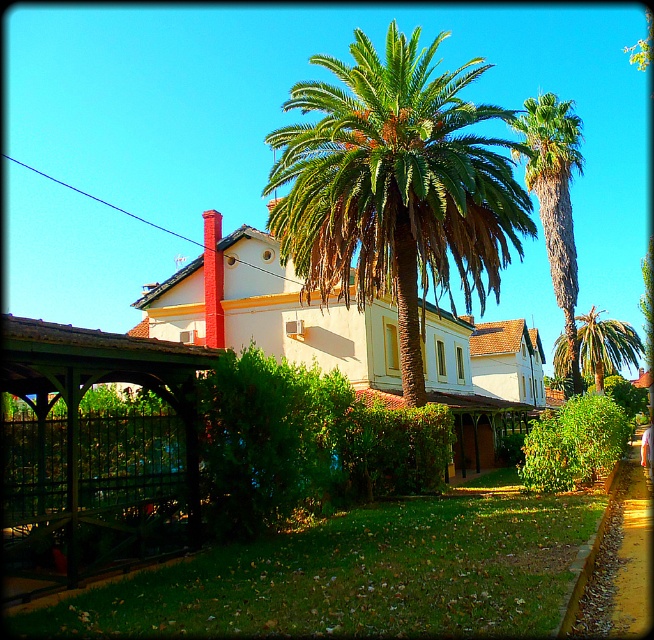
Between point (283, 214) and point (606, 348), which one is positioned in front?

Point (283, 214) is more forward.

Consider the image. Is green leafy palm at center taller than green leafy palm tree at center?

Indeed, green leafy palm at center has a greater height compared to green leafy palm tree at center.

Measure the distance between point (385, 200) and camera.

They are 14.45 meters apart.

Locate an element on the screen. The image size is (654, 640). green leafy palm at center is located at coordinates (396, 186).

Is green leafy palm at center thinner than green leafy palm at upper center?

Yes.

Is green leafy palm at center wider than green leafy palm at upper center?

Incorrect, green leafy palm at center's width does not surpass green leafy palm at upper center's.

Which is behind, point (402, 225) or point (528, 125)?

The point (528, 125) is more distant.

Find the location of `green leafy palm at center`. green leafy palm at center is located at coordinates (396, 186).

The width and height of the screenshot is (654, 640). What do you see at coordinates (555, 198) in the screenshot?
I see `green leafy palm at upper center` at bounding box center [555, 198].

Which is in front, point (532, 141) or point (610, 321)?

Positioned in front is point (532, 141).

Between point (545, 136) and point (555, 371), which one is positioned in front?

Point (545, 136) is more forward.

Locate an element on the screen. This screenshot has height=640, width=654. green leafy palm at upper center is located at coordinates [x=555, y=198].